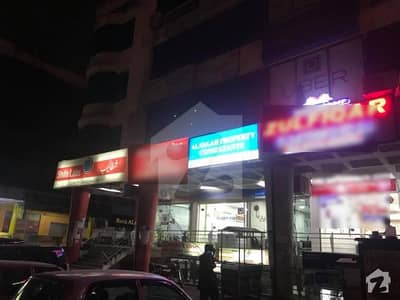
At what (x,y) coordinates should I click in order to perform the action: click on blurred window. Please return your answer as a coordinate pair (x, y). Looking at the image, I should click on tap(350, 202).